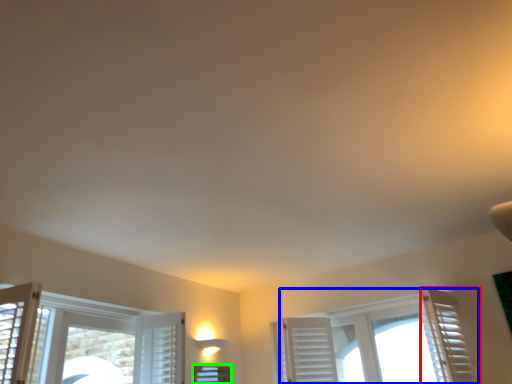
Question: Which is farther away from curtain (highlighted by a red box)? window (highlighted by a blue box) or window (highlighted by a green box)?

Choices:
 (A) window
 (B) window

Answer: (B)